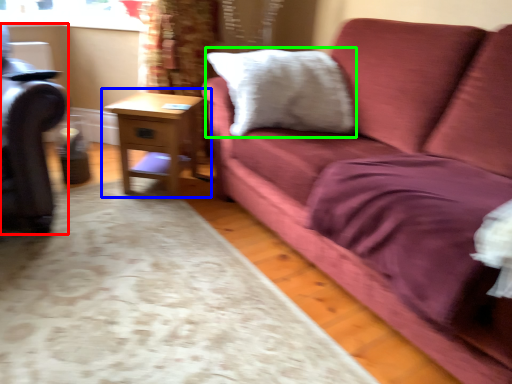
Question: Estimate the real-world distances between objects in this image. Which object is closer to swivel chair (highlighted by a red box), table (highlighted by a blue box) or pillow (highlighted by a green box)?

Choices:
 (A) table
 (B) pillow

Answer: (A)